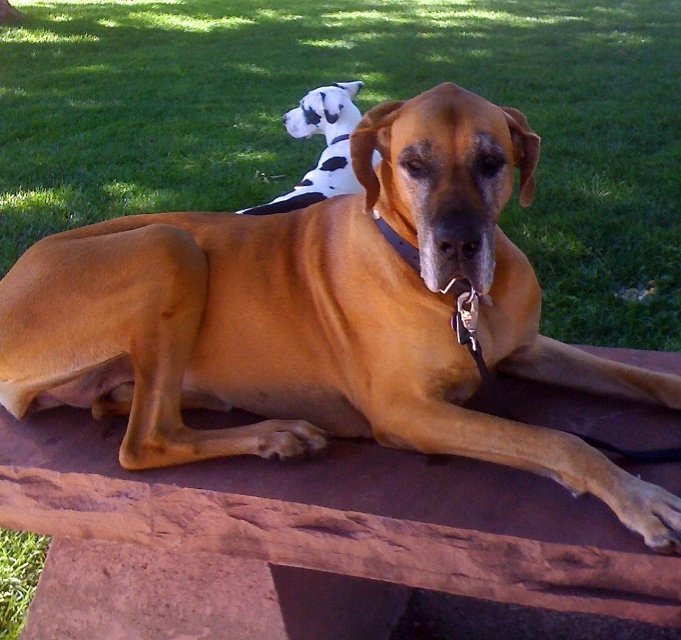
Who is higher up, green grass at upper center or black and white plush toy at upper center?

green grass at upper center is above.

Does green grass at upper center have a larger size compared to black and white plush toy at upper center?

Indeed, green grass at upper center has a larger size compared to black and white plush toy at upper center.

Is point (368, 26) farther from viewer compared to point (347, 156)?

That is True.

Identify the location of green grass at upper center. (362, 109).

Which is in front, point (242, 225) or point (25, 17)?

Positioned in front is point (242, 225).

Does brown smooth dog at center have a greater height compared to green grass at upper center?

Incorrect, brown smooth dog at center's height is not larger of green grass at upper center's.

Is point (287, 248) more distant than point (545, 48)?

No, it is in front of (545, 48).

You are a GUI agent. You are given a task and a screenshot of the screen. Output one action in this format:
    pyautogui.click(x=<x>, y=<y>)
    Task: Click on the brown smooth dog at center
    The image size is (681, 640).
    Given the screenshot: What is the action you would take?
    pyautogui.click(x=323, y=317)

Does brown smooth dog at center appear over black and white plush toy at upper center?

No, brown smooth dog at center is not above black and white plush toy at upper center.

Between point (524, 452) and point (302, 182), which one is positioned behind?

Point (302, 182)

Who is more distant from viewer, (360, 348) or (330, 109)?

The point (330, 109) is more distant.

Locate an element on the screen. This screenshot has height=640, width=681. brown smooth dog at center is located at coordinates (323, 317).